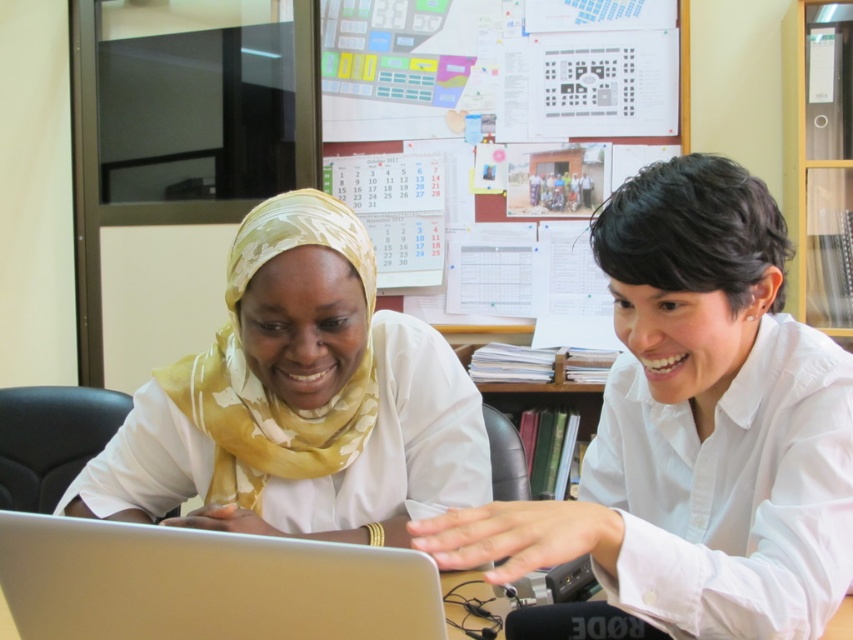
Can you confirm if white smooth shirt at center is positioned to the right of silver metallic laptop at center?

Correct, you'll find white smooth shirt at center to the right of silver metallic laptop at center.

Which is above, white smooth shirt at center or silver metallic laptop at center?

white smooth shirt at center is higher up.

Between point (763, 205) and point (125, 632), which one is positioned in front?

Positioned in front is point (125, 632).

Identify the location of white smooth shirt at center. (695, 428).

Between yellow floral scarf at center and silver metallic laptop at center, which one has more height?

Standing taller between the two is yellow floral scarf at center.

Is yellow floral scarf at center closer to camera compared to silver metallic laptop at center?

No, yellow floral scarf at center is further to the viewer.

This screenshot has width=853, height=640. Find the location of `yellow floral scarf at center`. yellow floral scarf at center is located at coordinates (299, 401).

Is point (821, 424) positioned after point (144, 460)?

No, it is not.

Is white smooth shirt at center smaller than yellow floral scarf at center?

Incorrect, white smooth shirt at center is not smaller in size than yellow floral scarf at center.

Is point (775, 260) behind point (236, 460)?

No, it is not.

This screenshot has width=853, height=640. I want to click on white smooth shirt at center, so click(x=695, y=428).